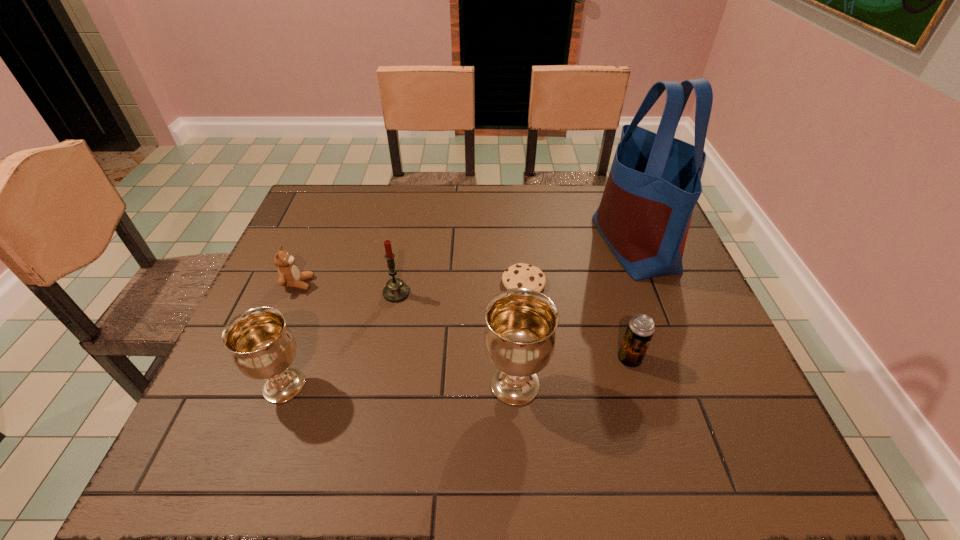
The chalices are evenly distributed in the image. To maintain this, where would you place another chalice on the right? Please point to a free space. Please provide its 2D coordinates. Your answer should be formatted as a tuple, i.e. [(x, y)], where the tuple contains the x and y coordinates of a point satisfying the conditions above.

[(745, 383)]